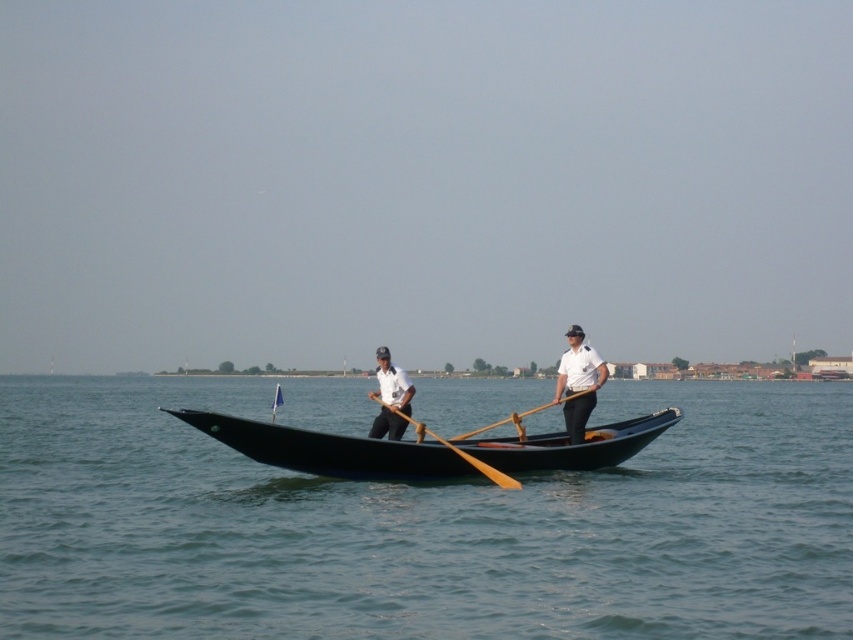
You are a tourist standing on a bridge overlooking the gondola. You notice the white matte shirt at center and the wooden paddle at center. Which object is nearer to you?

The white matte shirt at center is closer to the viewer than the wooden paddle at center.

You are a tourist standing on the dock and see the white matte shirt at center and the wooden paddle at center in the gondola. Which object is shorter?

The white matte shirt at center is shorter than the wooden paddle at center.

You are a tourist standing on the dock and see the point at coordinates (390, 397). What object is located at that point?

The white matte shirt at center is located at point (390, 397).